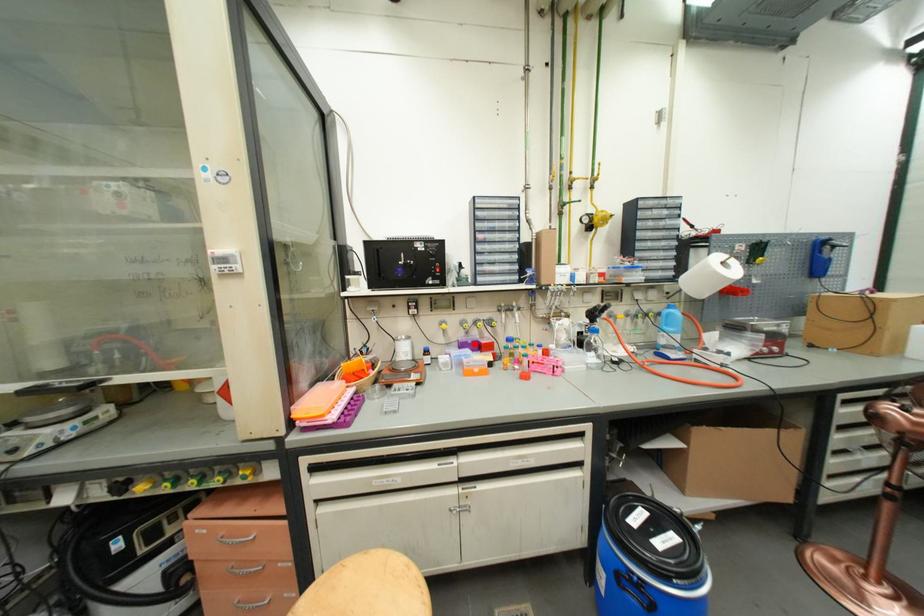
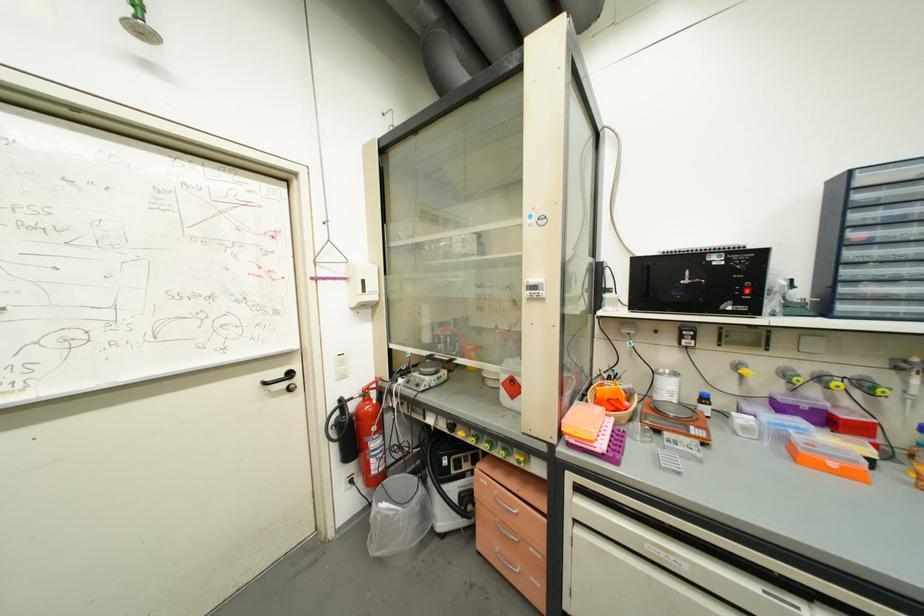
Where in the second image is the point corresponding to the highlighted location from the first image?

(807, 410)